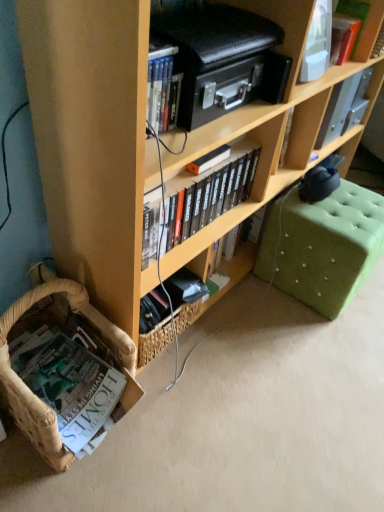
At what (x,y) coordinates should I click in order to perform the action: click on space that is in front of wooden bookcase at lower left. Please return your answer as a coordinate pair (x, y). Image resolution: width=384 pixels, height=512 pixels. Looking at the image, I should click on (259, 379).